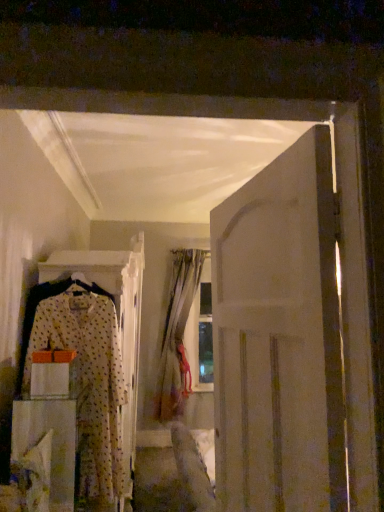
Describe the element at coordinates (279, 338) in the screenshot. I see `white matte door at right` at that location.

Locate an element on the screen. The image size is (384, 512). white fabric drawer at lower left is located at coordinates (53, 440).

From a real-world perspective, which object rests below the other?

In real-world perspective, white fabric drawer at lower left is lower.

How far apart are white fabric drawer at lower left and silky beige curtain at center?

They are 2.03 meters apart.

Is white fabric drawer at lower left next to silky beige curtain at center?

No, white fabric drawer at lower left is not in contact with silky beige curtain at center.

Relative to silky beige curtain at center, is white fabric drawer at lower left in front or behind?

Visually, white fabric drawer at lower left is located in front of silky beige curtain at center.

Consider the image. Does silky beige curtain at center have a smaller size compared to polka dot fabric dress at left?

Incorrect, silky beige curtain at center is not smaller in size than polka dot fabric dress at left.

Is silky beige curtain at center facing away from polka dot fabric dress at left?

No, silky beige curtain at center is not facing away from polka dot fabric dress at left.

Is the position of silky beige curtain at center more distant than that of polka dot fabric dress at left?

Yes, it is.

From the image's perspective, who appears lower, silky beige curtain at center or polka dot fabric dress at left?

silky beige curtain at center.

The height and width of the screenshot is (512, 384). In the image, there is a silky beige curtain at center. Identify the location of door above it (from the image's perspective). (279, 338).

From the picture: Is white matte door at right bigger than silky beige curtain at center?

No, white matte door at right is not bigger than silky beige curtain at center.

Is white matte door at right at the left side of silky beige curtain at center?

Incorrect, white matte door at right is not on the left side of silky beige curtain at center.

Is white matte door at right wider than silky beige curtain at center?

No.

From the image's perspective, is white matte door at right above or below white fabric drawer at lower left?

white matte door at right is situated higher than white fabric drawer at lower left in the image.

What's the angular difference between white matte door at right and white fabric drawer at lower left's facing directions?

white matte door at right and white fabric drawer at lower left are facing 173 degrees away from each other.

Consider the image. Are white matte door at right and white fabric drawer at lower left beside each other?

No, white matte door at right is not in contact with white fabric drawer at lower left.

Considering the sizes of objects white matte door at right and white fabric drawer at lower left in the image provided, who is bigger, white matte door at right or white fabric drawer at lower left?

white fabric drawer at lower left.

Locate an element on the screen. This screenshot has width=384, height=512. fancy dress below the silky beige curtain at center (from a real-world perspective) is located at coordinates (84, 377).

Can you tell me how much polka dot fabric dress at left and silky beige curtain at center differ in facing direction?

They differ by 0.016 degrees in their facing directions.

Is silky beige curtain at center at the back of polka dot fabric dress at left?

Correct, polka dot fabric dress at left is looking away from silky beige curtain at center.

Is polka dot fabric dress at left positioned beyond the bounds of silky beige curtain at center?

polka dot fabric dress at left lies outside silky beige curtain at center's area.

Which object is closer to the camera taking this photo, silky beige curtain at center or white matte door at right?

Positioned in front is white matte door at right.

In the scene shown: Considering the relative positions of silky beige curtain at center and white matte door at right in the image provided, is silky beige curtain at center to the left of white matte door at right from the viewer's perspective?

Yes, silky beige curtain at center is to the left of white matte door at right.

Is silky beige curtain at center situated inside white matte door at right or outside?

silky beige curtain at center is spatially situated outside white matte door at right.

How much distance is there between white fabric drawer at lower left and white matte door at right?

white fabric drawer at lower left and white matte door at right are 5.62 feet apart.

Is point (14, 432) closer or farther from the camera than point (226, 387)?

Point (14, 432) is positioned farther from the camera compared to point (226, 387).

Which object is further away from the camera, white fabric drawer at lower left or white matte door at right?

white fabric drawer at lower left is further from the camera.

From the image's perspective, which object appears higher, white fabric drawer at lower left or white matte door at right?

From the image's view, white matte door at right is above.

This screenshot has width=384, height=512. What are the coordinates of `furniture located on the left of silky beige curtain at center` in the screenshot? It's located at (53, 440).

Identify the location of curtain above the polka dot fabric dress at left (from a real-world perspective). The width and height of the screenshot is (384, 512). (177, 336).

When comparing their distances from polka dot fabric dress at left, does silky beige curtain at center or white fabric drawer at lower left seem closer?

white fabric drawer at lower left lies closer to polka dot fabric dress at left than the other object.

Looking at the image, which one is located further to white matte door at right, silky beige curtain at center or polka dot fabric dress at left?

silky beige curtain at center.

Looking at the image, which one is located further to white fabric drawer at lower left, polka dot fabric dress at left or white matte door at right?

Among the two, white matte door at right is located further to white fabric drawer at lower left.

Which object lies nearer to the anchor point white fabric drawer at lower left, silky beige curtain at center or polka dot fabric dress at left?

Among the two, polka dot fabric dress at left is located nearer to white fabric drawer at lower left.

Based on their spatial positions, is silky beige curtain at center or white fabric drawer at lower left closer to white matte door at right?

white fabric drawer at lower left.

Estimate the real-world distances between objects in this image. Which object is further from polka dot fabric dress at left, white fabric drawer at lower left or white matte door at right?

white matte door at right.

Based on the photo, looking at the image, which one is located closer to silky beige curtain at center, white fabric drawer at lower left or white matte door at right?

Among the two, white fabric drawer at lower left is located nearer to silky beige curtain at center.

When comparing their distances from silky beige curtain at center, does white matte door at right or white fabric drawer at lower left seem closer?

The object closer to silky beige curtain at center is white fabric drawer at lower left.

This screenshot has height=512, width=384. I want to click on fancy dress positioned between white fabric drawer at lower left and silky beige curtain at center from near to far, so click(x=84, y=377).

Image resolution: width=384 pixels, height=512 pixels. In order to click on furniture located between white matte door at right and silky beige curtain at center in the depth direction in this screenshot , I will do `click(53, 440)`.

Identify the location of fancy dress located between white matte door at right and silky beige curtain at center in the depth direction. (84, 377).

I want to click on furniture between white matte door at right and polka dot fabric dress at left along the z-axis, so click(x=53, y=440).